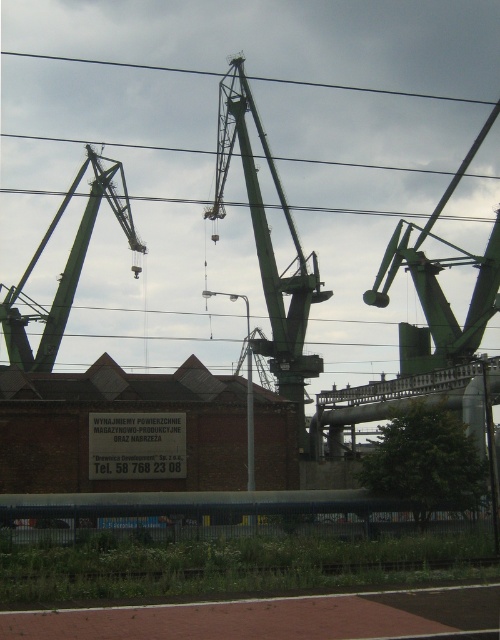
How distant is green matte crane at center from black wire at upper center?

They are 220.48 feet apart.

Can you confirm if green matte crane at center is bigger than black wire at upper center?

Correct, green matte crane at center is larger in size than black wire at upper center.

At what (x,y) coordinates should I click in order to perform the action: click on green matte crane at center. Please return your answer as a coordinate pair (x, y). Image resolution: width=500 pixels, height=640 pixels. Looking at the image, I should click on (269, 248).

At what (x,y) coordinates should I click in order to perform the action: click on green matte crane at center. Please return your answer as a coordinate pair (x, y). This screenshot has height=640, width=500. Looking at the image, I should click on (269, 248).

Does green metallic crane at left have a lesser width compared to black wire at upper center?

Yes.

Can you confirm if green metallic crane at left is bigger than black wire at upper center?

No.

You are a GUI agent. You are given a task and a screenshot of the screen. Output one action in this format:
    pyautogui.click(x=<x>, y=<y>)
    Task: Click on the green metallic crane at left
    Image resolution: width=500 pixels, height=640 pixels.
    Given the screenshot: What is the action you would take?
    pyautogui.click(x=64, y=269)

Which is more to the right, green matte crane at center or green metallic crane at left?

green matte crane at center

Between point (241, 80) and point (42, 316), which one is positioned behind?

Positioned behind is point (241, 80).

At what (x,y) coordinates should I click in order to perform the action: click on green matte crane at center. Please return your answer as a coordinate pair (x, y). The height and width of the screenshot is (640, 500). Looking at the image, I should click on (269, 248).